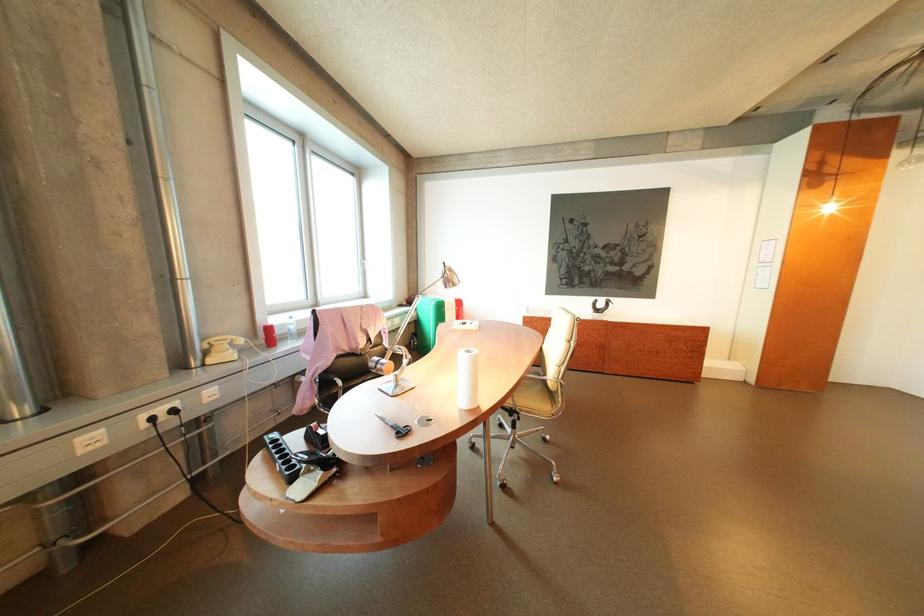
Image resolution: width=924 pixels, height=616 pixels. Describe the element at coordinates (447, 277) in the screenshot. I see `the silver lamp head` at that location.